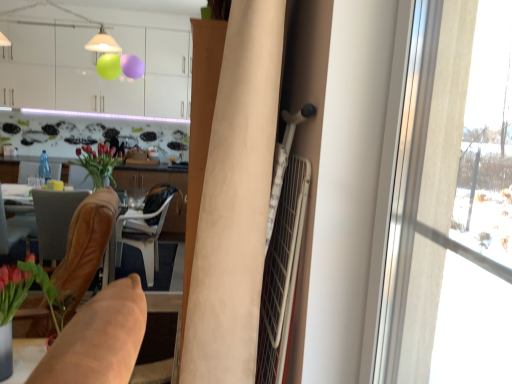
Question: Considering the positions of white plastic chair at center, which ranks as the 3th chair in front-to-back order, and transparent glass window at right in the image, is white plastic chair at center, which ranks as the 3th chair in front-to-back order, taller or shorter than transparent glass window at right?

Choices:
 (A) short
 (B) tall

Answer: (A)

Question: Which is correct: white plastic chair at center, which ranks as the 3th chair in front-to-back order, is inside transparent glass window at right, or outside of it?

Choices:
 (A) inside
 (B) outside

Answer: (B)

Question: Which object is the closest to the white plastic chair at center, which appears as the first chair when viewed from the back?

Choices:
 (A) matte brown vase at center
 (B) brown leather chair at lower left, which is the second chair from back to front
 (C) white glossy cabinets at upper center
 (D) transparent glass window at right
 (E) beige fabric curtain at center

Answer: (A)

Question: Which is farther from the transparent glass bottle at center?

Choices:
 (A) brown leather chair at left, marked as the 1th chair in a front-to-back arrangement
 (B) white plastic chair at center, which appears as the first chair when viewed from the back
 (C) beige fabric curtain at center
 (D) transparent glass window at right
 (E) white glossy cabinets at upper center

Answer: (D)